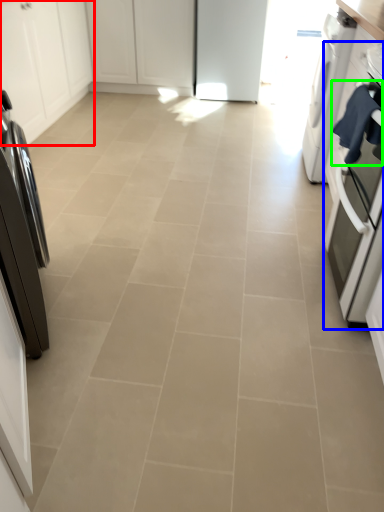
Question: Considering the real-world distances, which object is closest to cabinetry (highlighted by a red box)? kitchen appliance (highlighted by a blue box) or laundry (highlighted by a green box).

Choices:
 (A) kitchen appliance
 (B) laundry

Answer: (A)